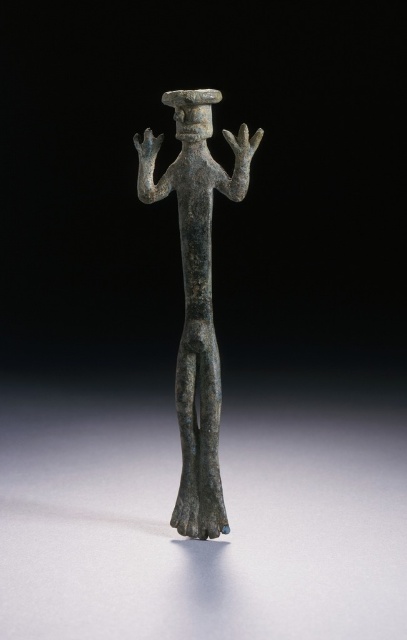
Question: Estimate the real-world distances between objects in this image. Which object is closer to the matte bronze hand at upper center?

Choices:
 (A) bronze statue at center
 (B) bronze textured hand at center

Answer: (B)

Question: Which object is closer to the camera taking this photo?

Choices:
 (A) bronze statue at center
 (B) bronze textured hand at center
 (C) matte bronze hand at upper center

Answer: (B)

Question: Can you confirm if bronze statue at center is thinner than bronze textured hand at center?

Choices:
 (A) no
 (B) yes

Answer: (A)

Question: Does bronze statue at center appear under matte bronze hand at upper center?

Choices:
 (A) yes
 (B) no

Answer: (A)

Question: Is bronze statue at center bigger than matte bronze hand at upper center?

Choices:
 (A) yes
 (B) no

Answer: (A)

Question: Which is farther from the bronze textured hand at center?

Choices:
 (A) matte bronze hand at upper center
 (B) bronze statue at center

Answer: (B)